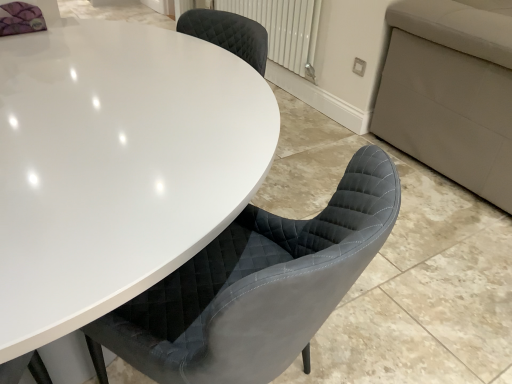
Question: Is there a large distance between white textured radiator at upper center and white glossy table at center?

Choices:
 (A) no
 (B) yes

Answer: (B)

Question: Is white textured radiator at upper center facing away from white glossy table at center?

Choices:
 (A) yes
 (B) no

Answer: (B)

Question: Is white textured radiator at upper center bigger than white glossy table at center?

Choices:
 (A) no
 (B) yes

Answer: (A)

Question: Can you confirm if white textured radiator at upper center is positioned to the right of white glossy table at center?

Choices:
 (A) yes
 (B) no

Answer: (A)

Question: From a real-world perspective, is white textured radiator at upper center located beneath white glossy table at center?

Choices:
 (A) yes
 (B) no

Answer: (B)

Question: Is white textured radiator at upper center closer to the viewer compared to white glossy table at center?

Choices:
 (A) no
 (B) yes

Answer: (A)

Question: Considering the relative positions of white glossy table at center and white textured radiator at upper center in the image provided, is white glossy table at center to the right of white textured radiator at upper center from the viewer's perspective?

Choices:
 (A) yes
 (B) no

Answer: (B)

Question: Does white glossy table at center turn towards white textured radiator at upper center?

Choices:
 (A) yes
 (B) no

Answer: (B)

Question: From a real-world perspective, is white glossy table at center on white textured radiator at upper center?

Choices:
 (A) no
 (B) yes

Answer: (A)

Question: Can you confirm if white glossy table at center is shorter than white textured radiator at upper center?

Choices:
 (A) yes
 (B) no

Answer: (B)

Question: Is white glossy table at center directly adjacent to white textured radiator at upper center?

Choices:
 (A) yes
 (B) no

Answer: (B)

Question: From a real-world perspective, is white glossy table at center positioned under white textured radiator at upper center based on gravity?

Choices:
 (A) yes
 (B) no

Answer: (A)

Question: Considering the positions of white textured radiator at upper center and white glossy table at center in the image, is white textured radiator at upper center wider or thinner than white glossy table at center?

Choices:
 (A) thin
 (B) wide

Answer: (A)